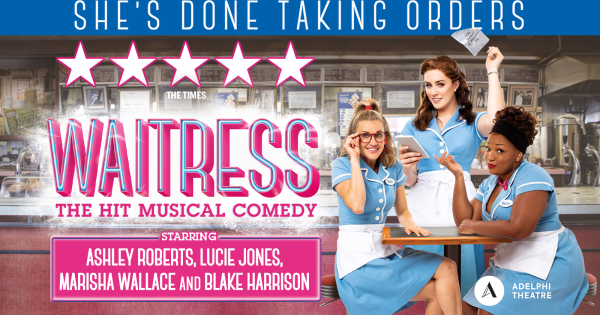
Identify the location of dessert case. The width and height of the screenshot is (600, 315). (16, 189).